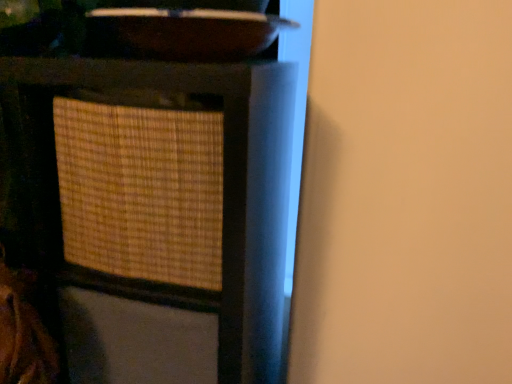
This screenshot has width=512, height=384. What do you see at coordinates (154, 185) in the screenshot?
I see `woven wood chair at left` at bounding box center [154, 185].

You are a GUI agent. You are given a task and a screenshot of the screen. Output one action in this format:
    pyautogui.click(x=<x>, y=<y>)
    Task: Click on the woven wood chair at left
    The height and width of the screenshot is (384, 512).
    Given the screenshot: What is the action you would take?
    pyautogui.click(x=154, y=185)

Identify the location of woven wood chair at left. Image resolution: width=512 pixels, height=384 pixels. (154, 185).